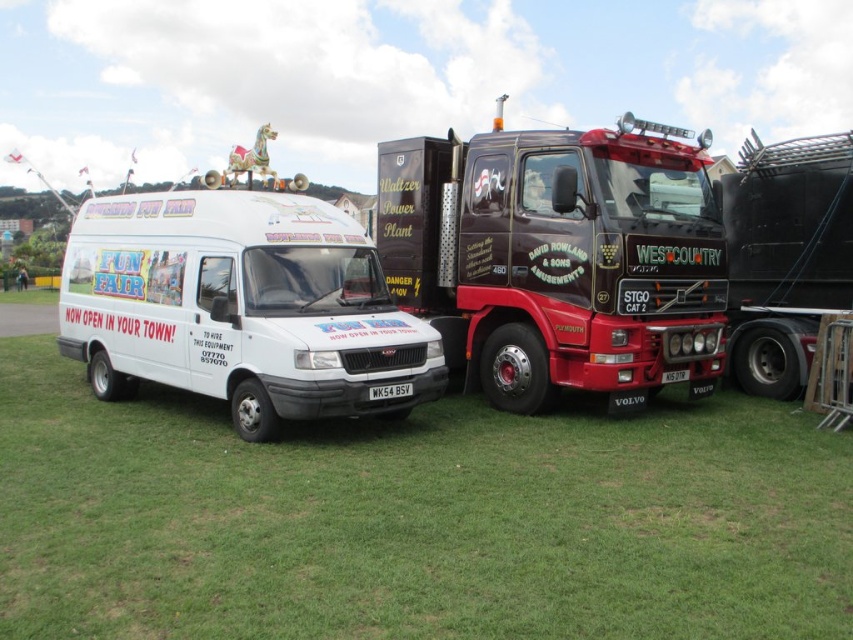
Between white glossy van at left and black textured trailer truck at right, which one has more height?

Standing taller between the two is black textured trailer truck at right.

This screenshot has height=640, width=853. What do you see at coordinates (241, 307) in the screenshot?
I see `white glossy van at left` at bounding box center [241, 307].

Who is more distant from viewer, (329, 259) or (846, 177)?

Positioned behind is point (846, 177).

Find the location of a particular element. The image size is (853, 640). white glossy van at left is located at coordinates (241, 307).

Is green grass at lower center closer to the viewer compared to shiny metallic truck at center?

Yes, it is in front of shiny metallic truck at center.

Does green grass at lower center have a lesser width compared to shiny metallic truck at center?

Incorrect, green grass at lower center's width is not less than shiny metallic truck at center's.

Describe the element at coordinates (415, 520) in the screenshot. The width and height of the screenshot is (853, 640). I see `green grass at lower center` at that location.

This screenshot has width=853, height=640. I want to click on green grass at lower center, so click(415, 520).

Does shiny metallic truck at center appear on the right side of white glossy van at left?

Correct, you'll find shiny metallic truck at center to the right of white glossy van at left.

Can you confirm if shiny metallic truck at center is smaller than white glossy van at left?

Yes.

Between point (608, 404) and point (380, 356), which one is positioned in front?

Point (380, 356) is in front.

Locate an element on the screen. Image resolution: width=853 pixels, height=640 pixels. shiny metallic truck at center is located at coordinates (560, 259).